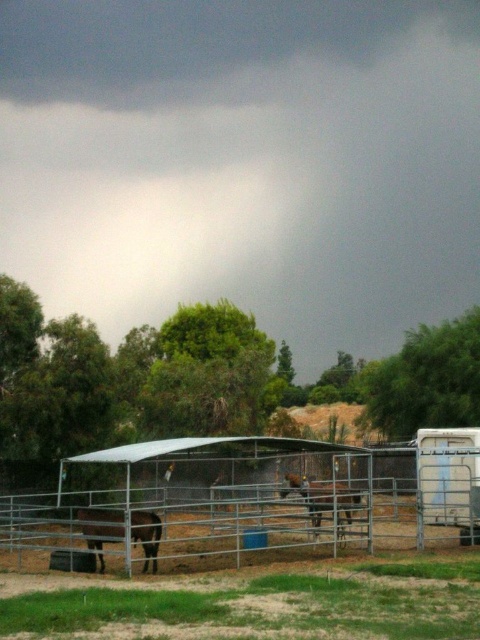
Between point (64, 464) and point (325, 506), which one is positioned in front?

Point (64, 464) is in front.

The width and height of the screenshot is (480, 640). Find the location of `metal/galvanized fence at center`. metal/galvanized fence at center is located at coordinates (248, 500).

Does dark gray cloud at upper center come in front of metal/galvanized fence at center?

No, dark gray cloud at upper center is behind metal/galvanized fence at center.

You are a GUI agent. You are given a task and a screenshot of the screen. Output one action in this format:
    pyautogui.click(x=<x>, y=<y>)
    Task: Click on the dark gray cloud at upper center
    
    Given the screenshot: What is the action you would take?
    pyautogui.click(x=243, y=163)

Can you confirm if dark gray cloud at upper center is smaller than brown matte horse at center?

No, dark gray cloud at upper center is not smaller than brown matte horse at center.

Does dark gray cloud at upper center appear on the left side of brown matte horse at center?

Indeed, dark gray cloud at upper center is positioned on the left side of brown matte horse at center.

Who is more forward, (356, 268) or (308, 497)?

Point (308, 497) is in front.

This screenshot has width=480, height=640. I want to click on dark gray cloud at upper center, so click(x=243, y=163).